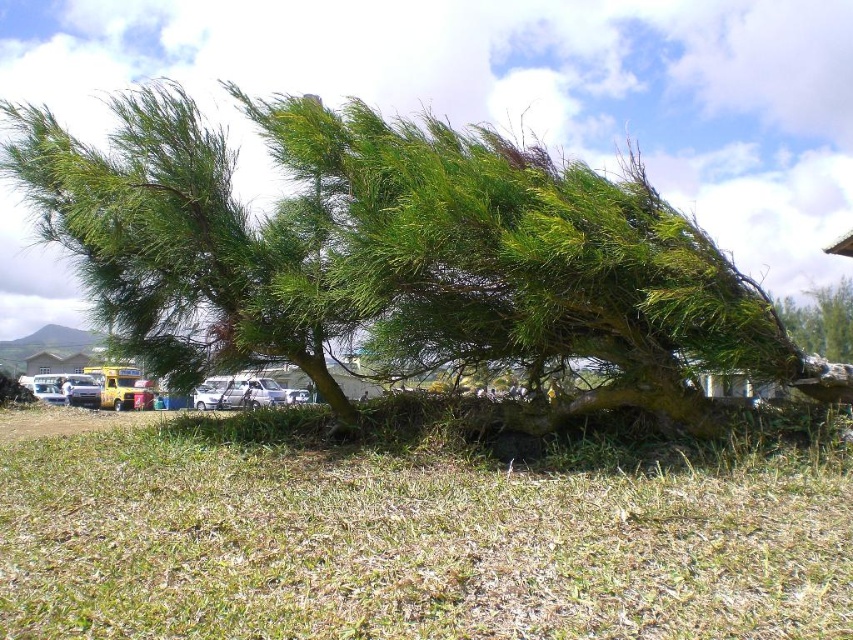
You are standing at the point labeled as point (408, 541) in the image. Looking around, you see the large windswept tree and the parking lot with vehicles. Which direction should you walk to reach the parking lot?

The point (408, 541) is on green dry grass at lower center, so to reach the parking lot in the background, you should walk towards the upper direction where the parking lot is located.

You are a bird looking for a nesting spot. You see the green leafy tree at center and the green leafy tree at upper right. Which tree would you choose if you prefer a taller nesting spot?

The green leafy tree at center is taller than the green leafy tree at upper right, so you should choose the green leafy tree at center for a taller nesting spot.

You are a parking attendant who notices the green leafy tree at upper right and the white matte car at center. Based on their positions, could the tree potentially damage the car during a storm?

The green leafy tree at upper right is positioned over the white matte car at center, so there is a risk that falling branches or debris from the tree could damage the car during a storm.